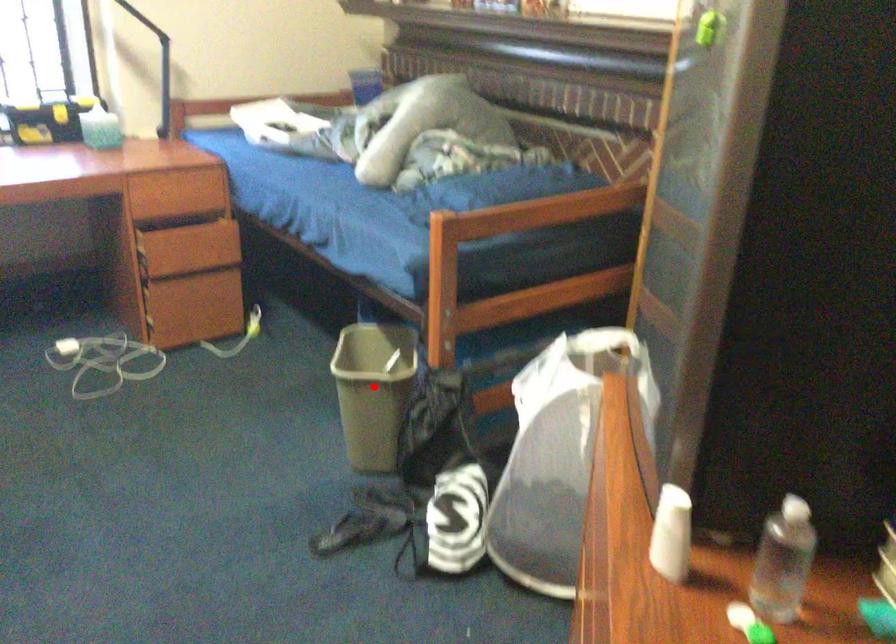
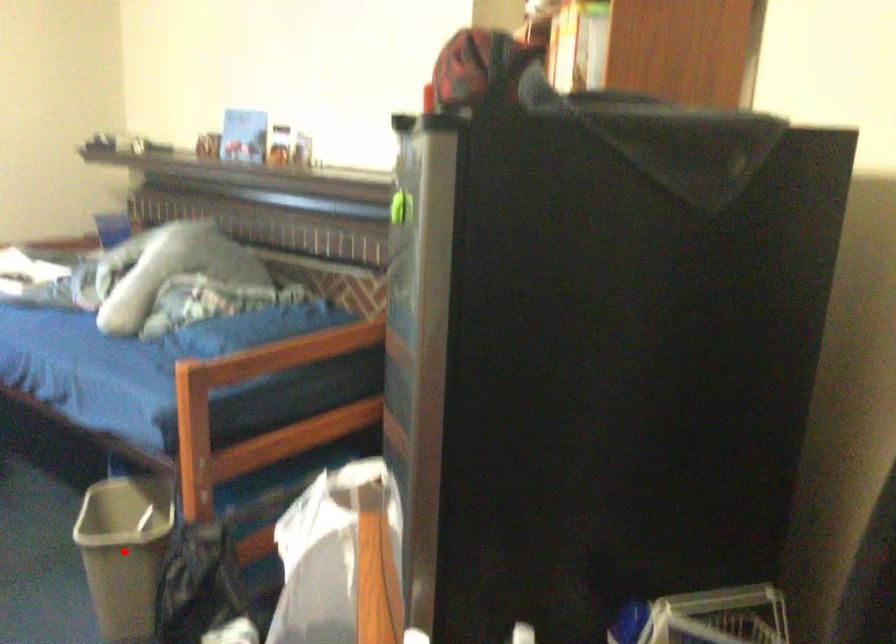
I am providing you with two images of the same scene from different viewpoints. A red point is marked on the first image and another point is marked on the second image. Is the red point in image1 aligned with the point shown in image2?

Yes